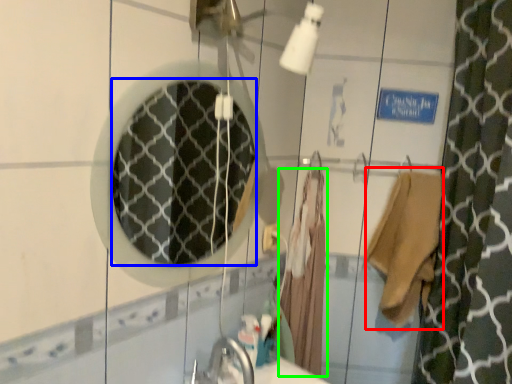
Question: Considering the real-world distances, which object is farthest from robe (highlighted by a red box)? mirror (highlighted by a blue box) or bathrobe (highlighted by a green box)?

Choices:
 (A) mirror
 (B) bathrobe

Answer: (A)